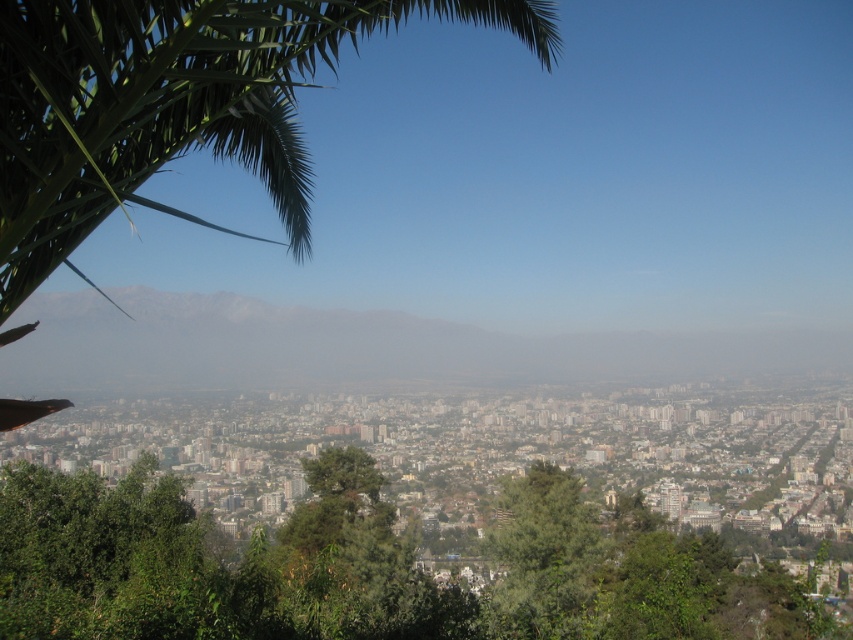
Question: Is green leafy tree at center above gray foggy mountain at center?

Choices:
 (A) no
 (B) yes

Answer: (A)

Question: Which object is the farthest from the green textured tree at center?

Choices:
 (A) gray foggy mountain at center
 (B) green leafy palm tree at upper left
 (C) green leafy tree at center

Answer: (B)

Question: Estimate the real-world distances between objects in this image. Which object is farther from the green leafy tree at center?

Choices:
 (A) green leafy palm tree at upper left
 (B) green textured tree at center
 (C) gray foggy mountain at center

Answer: (A)

Question: Is green leafy tree at center above green textured tree at center?

Choices:
 (A) no
 (B) yes

Answer: (A)

Question: Can you confirm if gray foggy mountain at center is positioned above green textured tree at center?

Choices:
 (A) no
 (B) yes

Answer: (B)

Question: Which is nearer to the green leafy palm tree at upper left?

Choices:
 (A) green textured tree at center
 (B) green leafy tree at center
 (C) gray foggy mountain at center

Answer: (C)